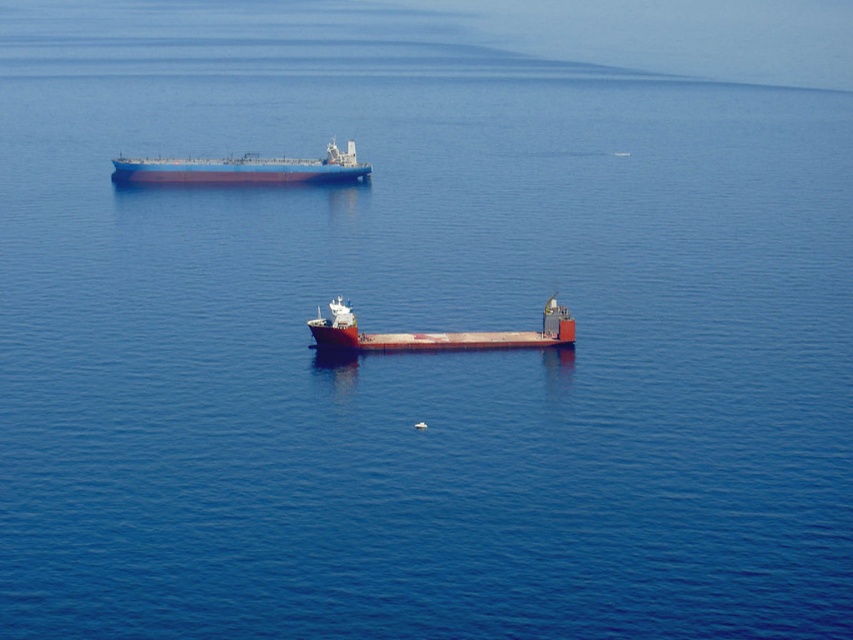
Between blue matte tanker at upper left and smooth red barge at center, which one appears on the left side from the viewer's perspective?

blue matte tanker at upper left

Does point (343, 160) come behind point (344, 305)?

Yes.

Does point (225, 161) lie in front of point (440, 340)?

That is False.

Locate an element on the screen. This screenshot has height=640, width=853. blue matte tanker at upper left is located at coordinates (242, 170).